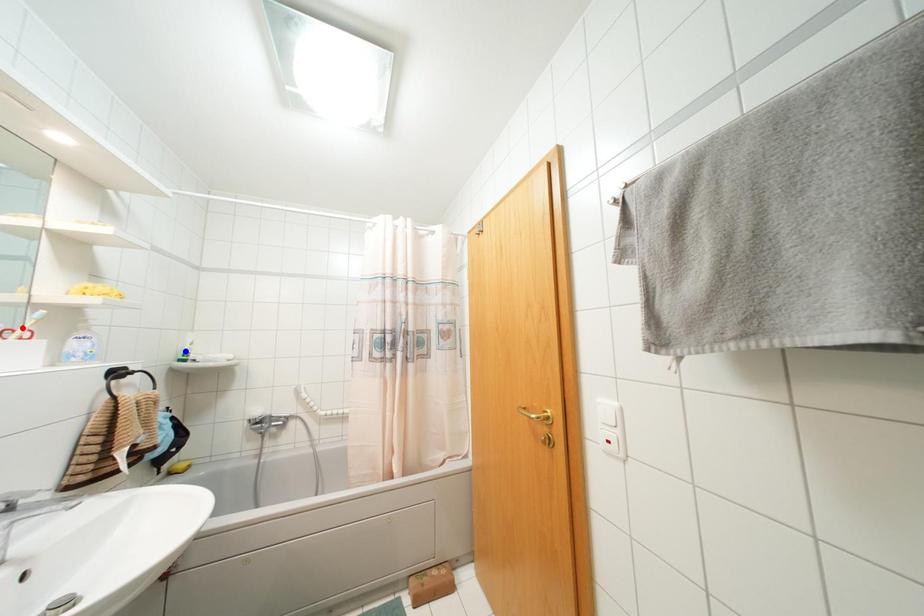
Question: Two points are marked on the image. Which point is closer to the camera?

Choices:
 (A) Blue point is closer.
 (B) Red point is closer.

Answer: (B)